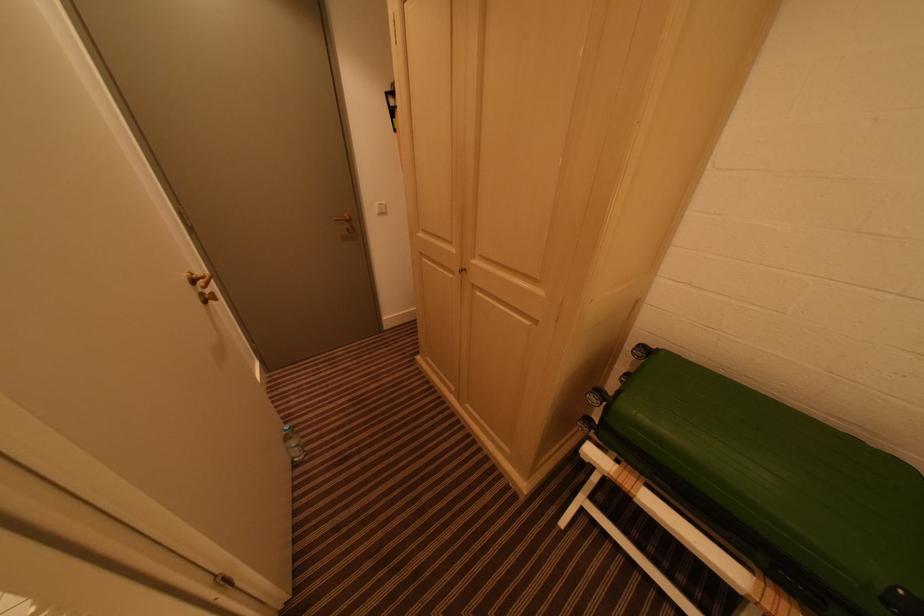
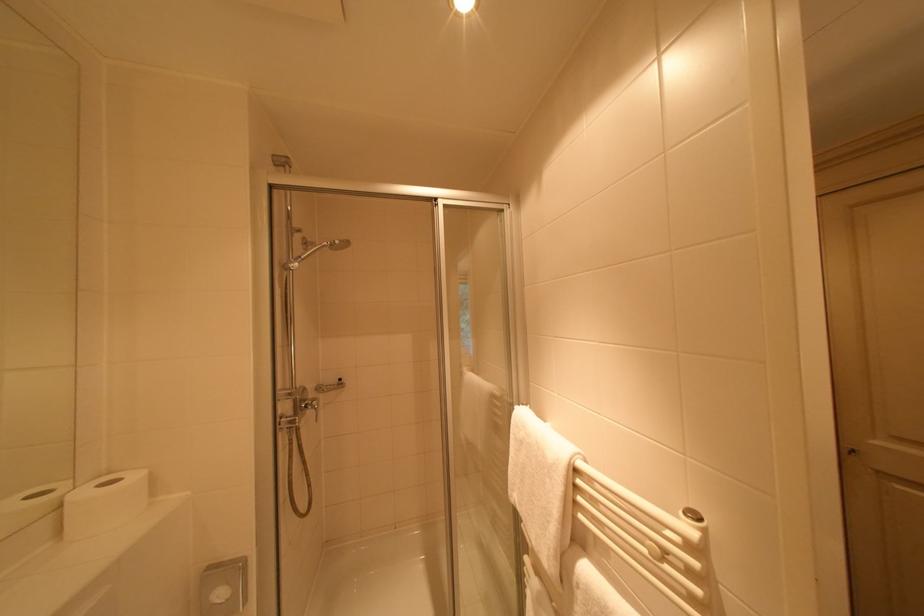
Question: I am providing you with two images of the same scene from different viewpoints. Which of the following objects are not visible in image2?

Choices:
 (A) yellow club headcover
 (B) square wall button
 (C) gold door handle
 (D) handheld shower head

Answer: (C)